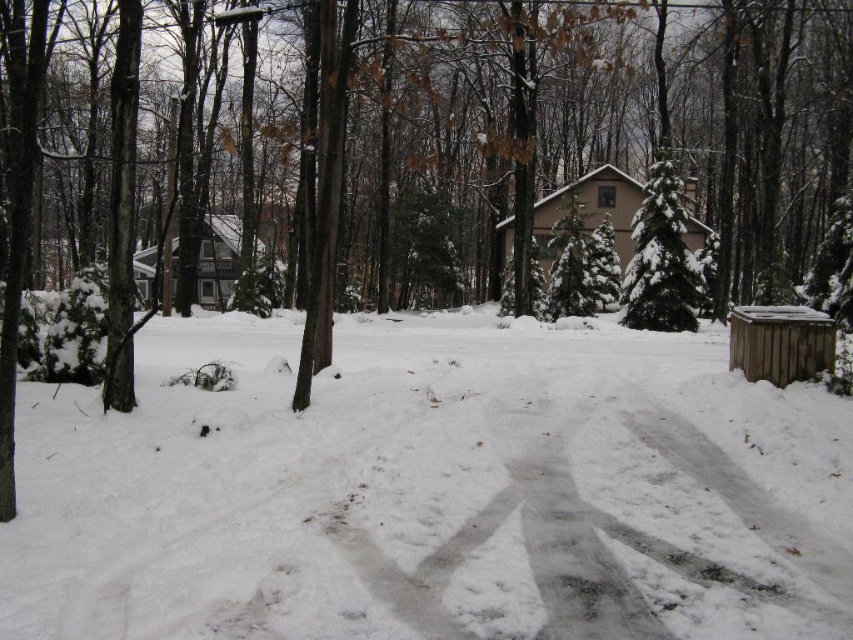
In the scene shown: You are standing in the winter woods and see two points marked in the image. Which point, point (294, 637) or point (670, 317), is nearer to you?

Point (294, 637) is closer to the viewer than point (670, 317).

You are an animal that needs to dig through the snow to find food. You see the white fluffy snow at center and the brown wooden shed at right. Which one is taller, requiring more effort to dig through?

The white fluffy snow at center has a greater height compared to the brown wooden shed at right, so it would require more effort to dig through.

You are an outdoor photographer planning to set up a tripod in this winter scene. You want to place your tripod on the white fluffy snow at center without it being blocked by the brown wooden shed at right. Is the snow at center visible and unobstructed from where you are standing?

The white fluffy snow at center is below the brown wooden shed at right, so it might be partially blocked by the shed. Choose a different spot to ensure your tripod setup remains visible and unobstructed.